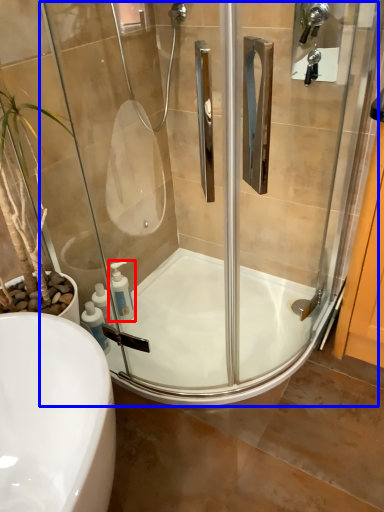
Question: Which object appears farthest to the camera in this image, soap dispenser (highlighted by a red box) or screen door (highlighted by a blue box)?

Choices:
 (A) soap dispenser
 (B) screen door

Answer: (A)